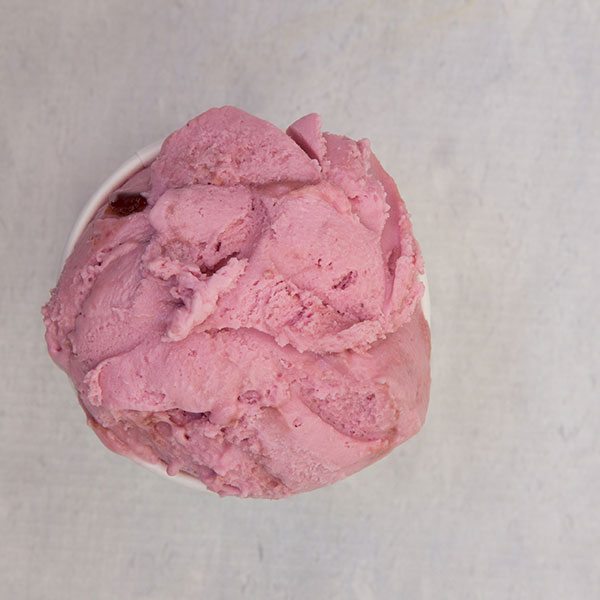
Where is `tabletop`? Image resolution: width=600 pixels, height=600 pixels. tabletop is located at coordinates (523, 445).